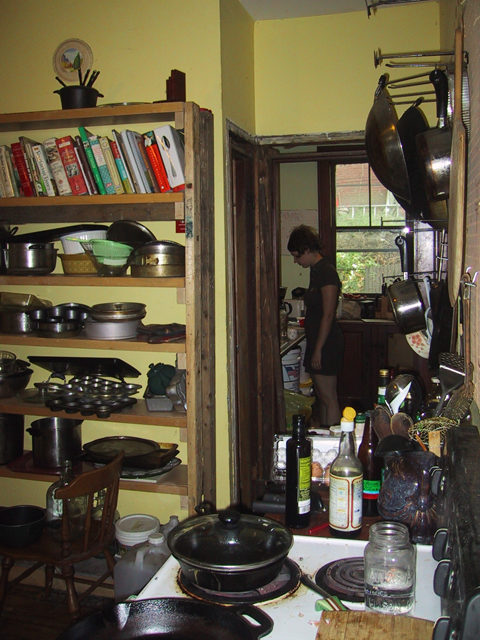
Where is `pots`? The width and height of the screenshot is (480, 640). pots is located at coordinates (247, 557), (34, 260), (57, 440), (396, 304).